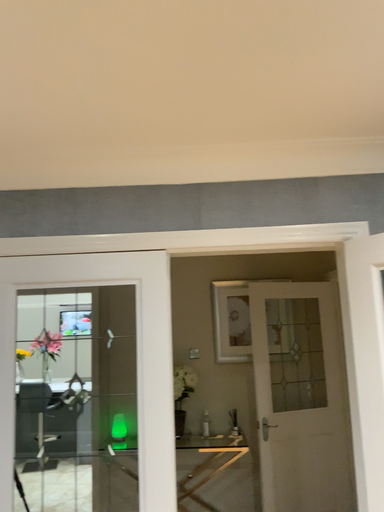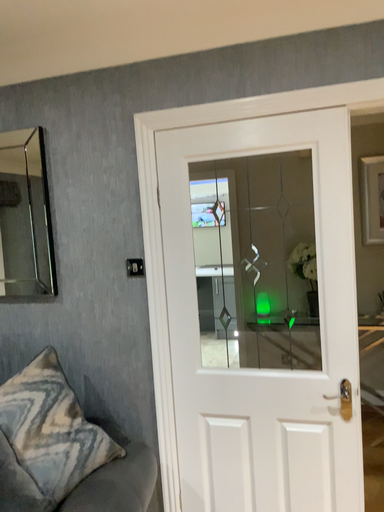
Question: How did the camera likely rotate when shooting the video?

Choices:
 (A) rotated left
 (B) rotated right

Answer: (A)